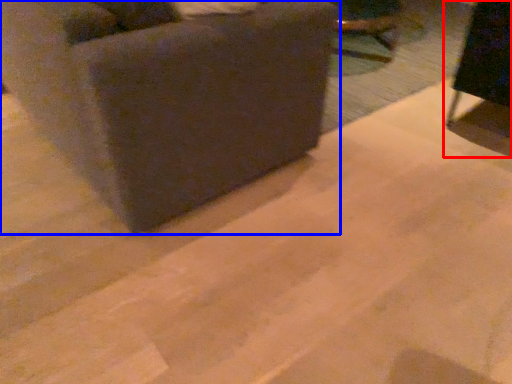
Question: Which object appears farthest to the camera in this image, furniture (highlighted by a red box) or furniture (highlighted by a blue box)?

Choices:
 (A) furniture
 (B) furniture

Answer: (A)